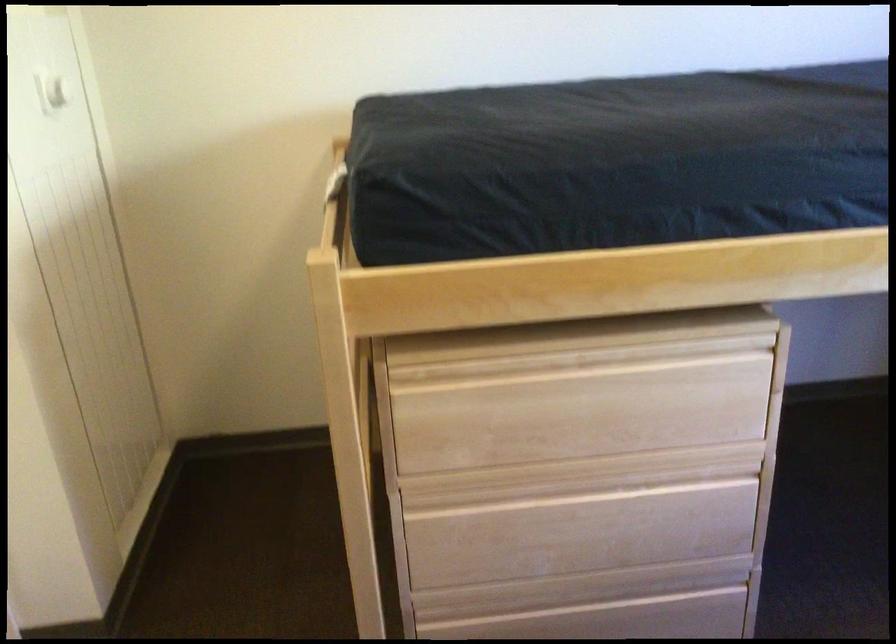
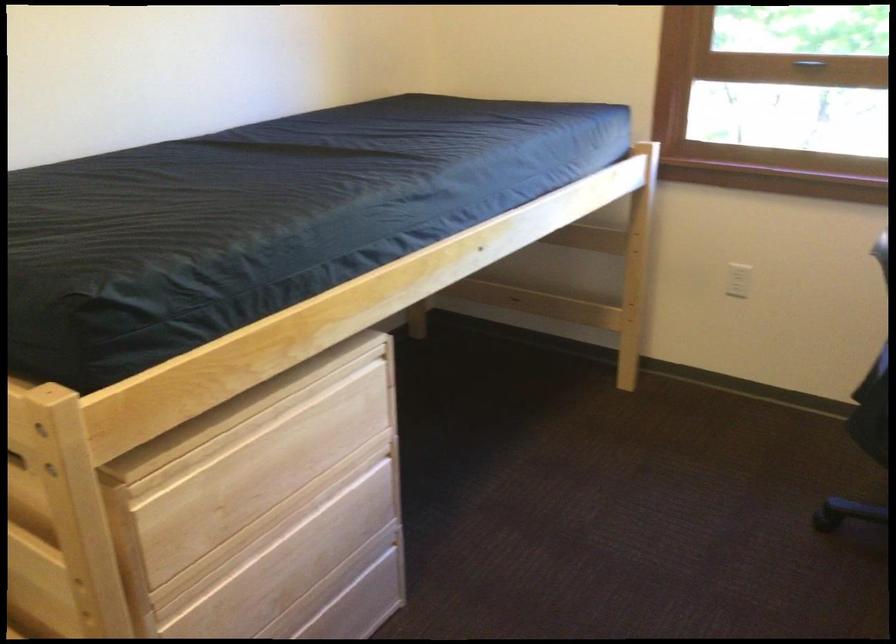
In the second image, find the point that corresponds to point (497, 526) in the first image.

(230, 601)